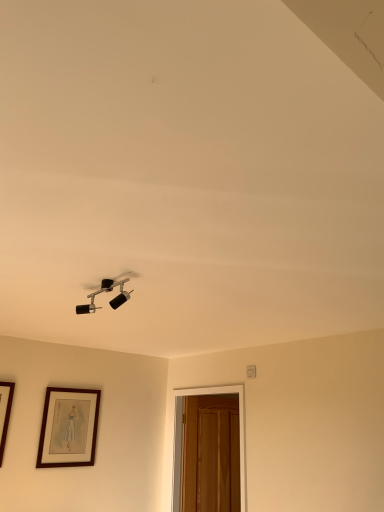
Question: Would you say brown wooden picture frame at lower left is inside or outside wooden door at lower right?

Choices:
 (A) inside
 (B) outside

Answer: (B)

Question: Looking at their shapes, would you say brown wooden picture frame at lower left is wider or thinner than wooden door at lower right?

Choices:
 (A) thin
 (B) wide

Answer: (A)

Question: Considering the real-world distances, which object is farthest from the matte black light fixture at upper center?

Choices:
 (A) wooden door at lower right
 (B) brown wooden picture frame at lower left

Answer: (A)

Question: Which object is positioned closest to the brown wooden picture frame at lower left?

Choices:
 (A) wooden door at lower right
 (B) matte black light fixture at upper center

Answer: (A)